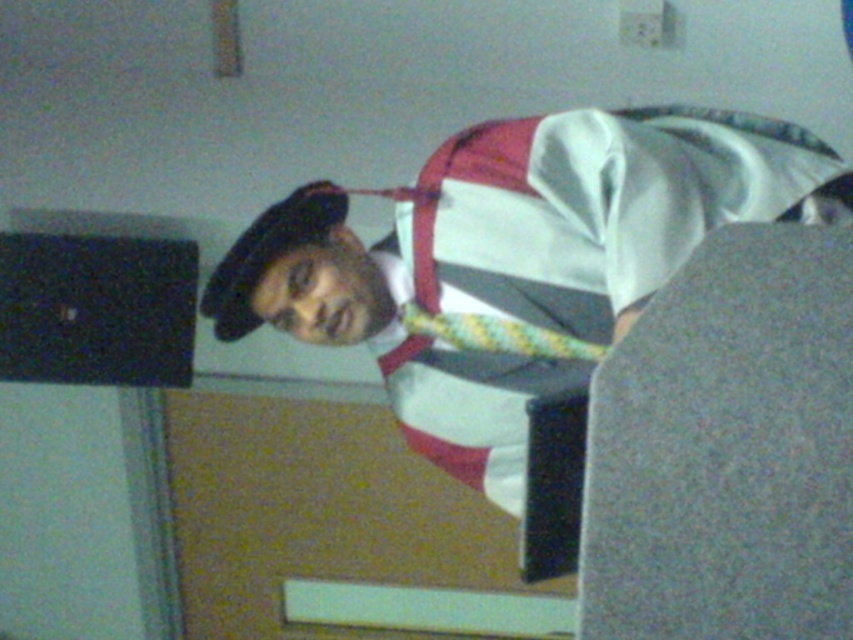
You are a photographer setting up for a photoshoot. You need to position a camera so that the white satin hat at upper left is in focus. Given that the hat is 1.32 meters away from the camera, what is the minimum distance you should set the camera focus to ensure the hat is sharp?

The white satin hat at upper left is 1.32 meters from the camera, so the minimum focus distance should be set to at least 1.32 meters to ensure it is in sharp focus.

You are standing at the point marked as point (483, 147). You want to move to the bed or couch on the right side of the room. Can you reach it without crossing any obstacles?

The distance between you and the bed or couch on the right side of the room is 5.34 feet. Since there are no obstacles mentioned in the scene description, you can reach it without any issues.